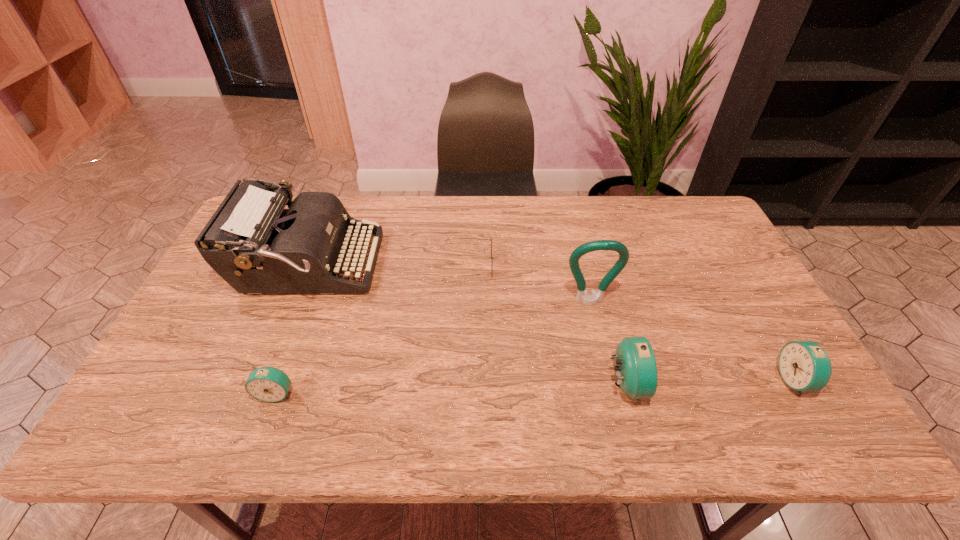
I want to click on vacant space located 0.390m on the front-facing side of the tallest alarm clock, so (x=805, y=384).

Where is `vacant region located on the front-facing side of the second tallest alarm clock`? The height and width of the screenshot is (540, 960). vacant region located on the front-facing side of the second tallest alarm clock is located at coordinates (739, 380).

Find the location of a particular element. vacant space situated on the front-facing side of the second tallest alarm clock is located at coordinates (723, 380).

This screenshot has height=540, width=960. I want to click on free space located on the front-facing side of the second tallest alarm clock, so click(710, 380).

Find the location of a particular element. The height and width of the screenshot is (540, 960). free space located 0.050m on the temples of the spectacles is located at coordinates (511, 265).

Locate an element on the screen. This screenshot has height=540, width=960. vacant space situated 0.190m on the front-facing side of the typewriter is located at coordinates (439, 266).

Identify the location of free location located 0.180m at the jaws of the bottle opener. (604, 366).

Locate an element on the screen. This screenshot has width=960, height=540. object that is at the far edge is located at coordinates (252, 242).

Find the location of a particular element. The width and height of the screenshot is (960, 540). object present at the left edge is located at coordinates (252, 242).

I want to click on object present at the right edge, so click(x=804, y=365).